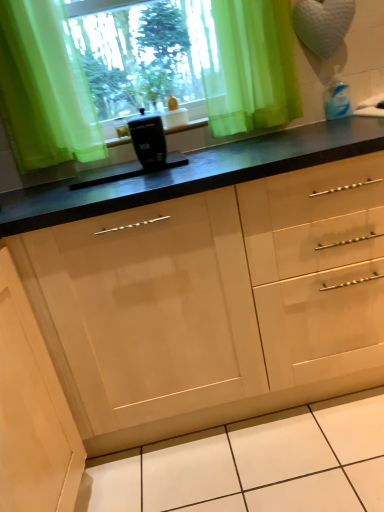
Question: From the image's perspective, is black plastic coffee maker at center located above or below translucent green curtain at upper center?

Choices:
 (A) above
 (B) below

Answer: (B)

Question: Considering the positions of black plastic coffee maker at center and translucent green curtain at upper center in the image, is black plastic coffee maker at center taller or shorter than translucent green curtain at upper center?

Choices:
 (A) short
 (B) tall

Answer: (A)

Question: Which of these objects is positioned closest to the matte wood cabinet at lower left?

Choices:
 (A) black plastic coffee maker at center
 (B) green sheer curtain at upper center
 (C) black plastic container at center
 (D) translucent green curtain at upper center

Answer: (A)

Question: Which is farther from the translucent green curtain at upper center?

Choices:
 (A) black plastic coffee maker at center
 (B) green sheer curtain at upper center
 (C) black plastic container at center
 (D) matte wood cabinet at lower left

Answer: (D)